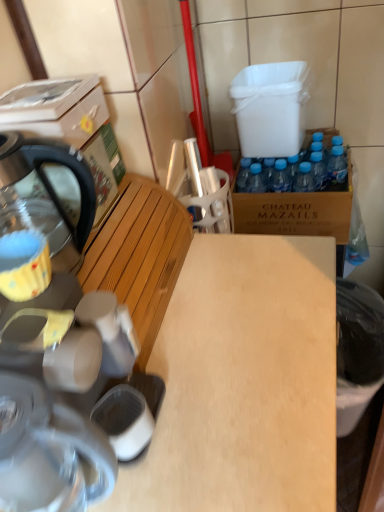
Locate an element on the screen. This screenshot has width=384, height=512. vacant space to the right of matte gray coffee machine at lower left is located at coordinates (215, 382).